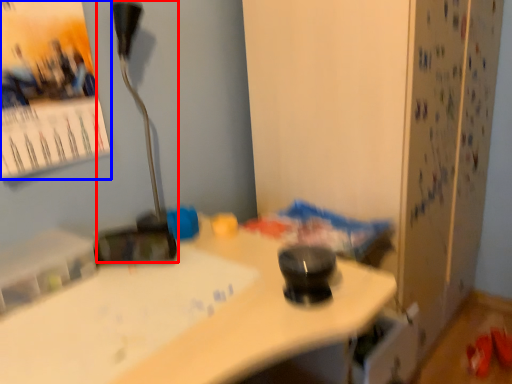
Question: Which of the following is the closest to the observer, lamp (highlighted by a red box) or poster page (highlighted by a blue box)?

Choices:
 (A) lamp
 (B) poster page

Answer: (B)